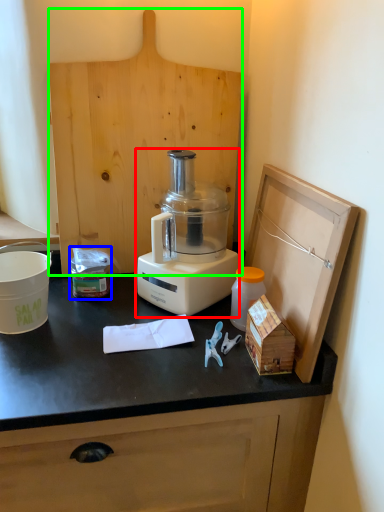
Question: Which object is the closest to the blender (highlighted by a red box)? Choose among these: waste (highlighted by a blue box) or wood (highlighted by a green box).

Choices:
 (A) waste
 (B) wood

Answer: (B)